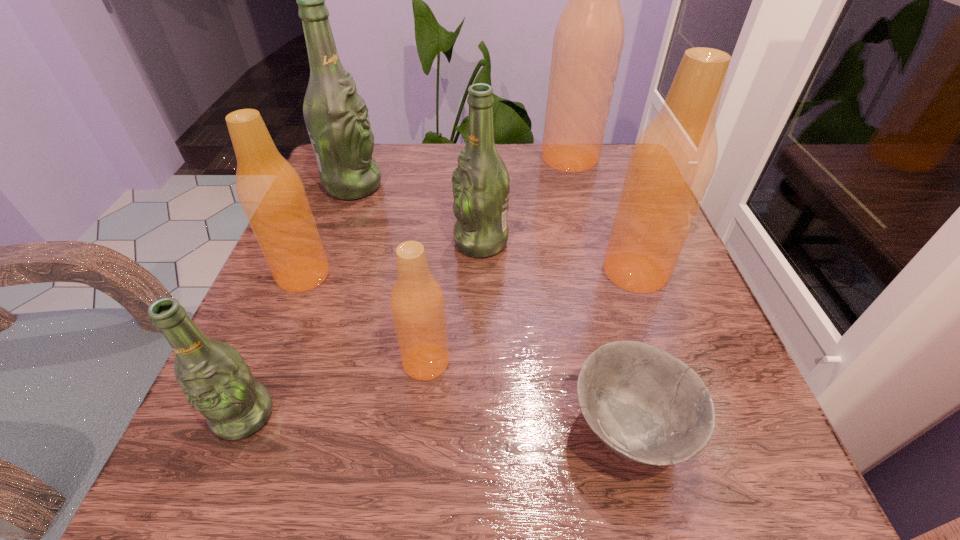
Where is `the nearest green beer bottle`? The height and width of the screenshot is (540, 960). the nearest green beer bottle is located at coordinates (216, 381).

Where is `bowl`? The image size is (960, 540). bowl is located at coordinates (645, 404).

In order to click on vacant area situated 0.050m on the left of the tallest object in this screenshot , I will do `click(520, 158)`.

You are a GUI agent. You are given a task and a screenshot of the screen. Output one action in this format:
    pyautogui.click(x=<x>, y=<y>)
    Task: Click on the free space located 0.180m on the surface of the farthest green beer bottle
    Image resolution: width=960 pixels, height=540 pixels.
    Given the screenshot: What is the action you would take?
    (x=462, y=186)

The width and height of the screenshot is (960, 540). Identify the location of free space located on the left of the third smallest tan beer bottle. (509, 272).

Where is `free space located on the surface of the second nearest green beer bottle`? free space located on the surface of the second nearest green beer bottle is located at coordinates (315, 242).

At what (x,y) coordinates should I click in order to perform the action: click on free space located 0.170m on the surface of the second nearest green beer bottle. Please return your answer as a coordinate pair (x, y). This screenshot has width=960, height=540. Looking at the image, I should click on (367, 242).

The height and width of the screenshot is (540, 960). In order to click on free space located on the surface of the second nearest green beer bottle in this screenshot , I will do `click(300, 242)`.

Find the location of a particular element. This screenshot has width=960, height=540. vacant space situated 0.320m on the back of the leftmost tan beer bottle is located at coordinates (347, 167).

Find the location of a particular element. This screenshot has width=960, height=540. vacant space situated on the left of the nearest tan beer bottle is located at coordinates (283, 362).